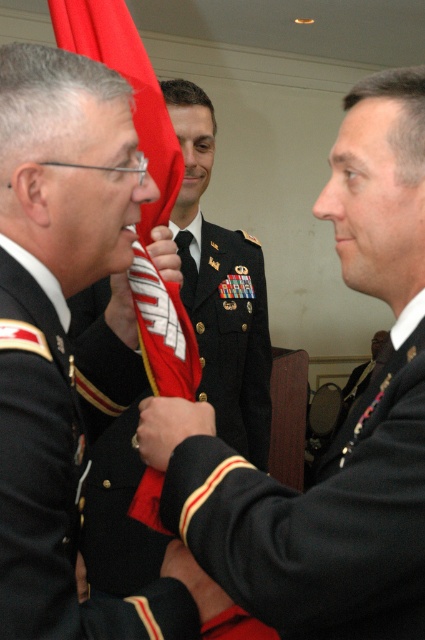
Can you confirm if shiny black uniform at center is positioned to the right of red fabric flag at center?

Indeed, shiny black uniform at center is positioned on the right side of red fabric flag at center.

I want to click on shiny black uniform at center, so click(x=229, y=330).

Does shiny black uniform at center appear on the right side of dark green fabric uniform at center?

No, shiny black uniform at center is not to the right of dark green fabric uniform at center.

Does shiny black uniform at center appear on the left side of dark green fabric uniform at center?

Yes, shiny black uniform at center is to the left of dark green fabric uniform at center.

Locate an element on the screen. The height and width of the screenshot is (640, 425). shiny black uniform at center is located at coordinates (229, 330).

The height and width of the screenshot is (640, 425). I want to click on shiny black uniform at center, so click(229, 330).

Who is higher up, black matte uniform at center or red fabric flag at center?

Positioned higher is red fabric flag at center.

Can you confirm if black matte uniform at center is bigger than red fabric flag at center?

No, black matte uniform at center is not bigger than red fabric flag at center.

Which is behind, point (418, 349) or point (95, 51)?

Point (95, 51)

This screenshot has width=425, height=640. I want to click on black matte uniform at center, so click(320, 515).